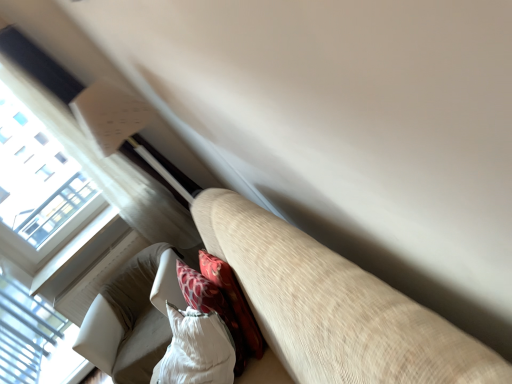
Question: From the image's perspective, would you say white textured bean bag chair at lower center, positioned as the first bean bag chair in front-to-back order, is shown under white textured bean bag chair at lower left, arranged as the 2th bean bag chair when viewed from the front?

Choices:
 (A) yes
 (B) no

Answer: (B)

Question: Considering the relative sizes of white textured bean bag chair at lower center, acting as the 2th bean bag chair starting from the back, and white textured bean bag chair at lower left, arranged as the 2th bean bag chair when viewed from the front, in the image provided, is white textured bean bag chair at lower center, acting as the 2th bean bag chair starting from the back, taller than white textured bean bag chair at lower left, arranged as the 2th bean bag chair when viewed from the front,?

Choices:
 (A) yes
 (B) no

Answer: (B)

Question: Is white textured bean bag chair at lower center, acting as the 2th bean bag chair starting from the back, positioned far away from white textured bean bag chair at lower left, which ranks as the first bean bag chair in back-to-front order?

Choices:
 (A) no
 (B) yes

Answer: (A)

Question: Is white textured bean bag chair at lower left, arranged as the 2th bean bag chair when viewed from the front, a part of white textured bean bag chair at lower center, positioned as the first bean bag chair in front-to-back order?

Choices:
 (A) no
 (B) yes

Answer: (A)

Question: Is white textured bean bag chair at lower center, positioned as the first bean bag chair in front-to-back order, outside of white textured bean bag chair at lower left, arranged as the 2th bean bag chair when viewed from the front?

Choices:
 (A) no
 (B) yes

Answer: (B)

Question: Is beige fabric couch at lower left situated inside white textured bean bag chair at lower left, arranged as the 2th bean bag chair when viewed from the front, or outside?

Choices:
 (A) inside
 (B) outside

Answer: (B)

Question: In the image, is beige fabric couch at lower left positioned in front of or behind white textured bean bag chair at lower left, arranged as the 2th bean bag chair when viewed from the front?

Choices:
 (A) front
 (B) behind

Answer: (A)

Question: In terms of size, does beige fabric couch at lower left appear bigger or smaller than white textured bean bag chair at lower left, arranged as the 2th bean bag chair when viewed from the front?

Choices:
 (A) small
 (B) big

Answer: (B)

Question: From the image's perspective, relative to white textured bean bag chair at lower left, which ranks as the first bean bag chair in back-to-front order, is beige fabric couch at lower left above or below?

Choices:
 (A) below
 (B) above

Answer: (B)

Question: Choose the correct answer: Is white textured bean bag chair at lower center, acting as the 2th bean bag chair starting from the back, inside white plastic window at lower left or outside it?

Choices:
 (A) inside
 (B) outside

Answer: (B)

Question: Relative to white plastic window at lower left, is white textured bean bag chair at lower center, positioned as the first bean bag chair in front-to-back order, in front or behind?

Choices:
 (A) front
 (B) behind

Answer: (A)

Question: Is white textured bean bag chair at lower center, acting as the 2th bean bag chair starting from the back, bigger or smaller than white plastic window at lower left?

Choices:
 (A) big
 (B) small

Answer: (A)

Question: Looking at their shapes, would you say white textured bean bag chair at lower center, acting as the 2th bean bag chair starting from the back, is wider or thinner than white plastic window at lower left?

Choices:
 (A) thin
 (B) wide

Answer: (B)

Question: Considering their positions, is beige fabric couch at lower left located in front of or behind white plastic window at lower left?

Choices:
 (A) front
 (B) behind

Answer: (A)

Question: Considering the positions of beige fabric couch at lower left and white plastic window at lower left in the image, is beige fabric couch at lower left bigger or smaller than white plastic window at lower left?

Choices:
 (A) small
 (B) big

Answer: (B)